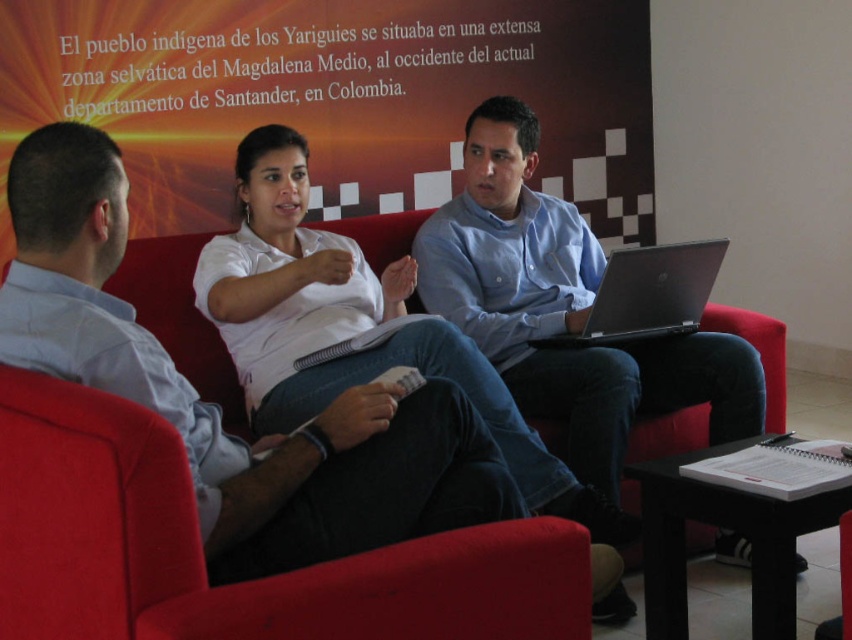
Is matte fabric armchair at lower left thinner than white cotton shirt at center?

Yes, matte fabric armchair at lower left is thinner than white cotton shirt at center.

Identify the location of matte fabric armchair at lower left. The width and height of the screenshot is (852, 640). (202, 556).

Which is in front, point (429, 568) or point (323, 381)?

Point (429, 568) is in front.

The height and width of the screenshot is (640, 852). Identify the location of matte fabric armchair at lower left. (202, 556).

Locate an element on the screen. red fabric couch at center is located at coordinates (200, 556).

Which is in front, point (85, 531) or point (625, 250)?

Point (85, 531) is in front.

You are a GUI agent. You are given a task and a screenshot of the screen. Output one action in this format:
    pyautogui.click(x=<x>, y=<y>)
    Task: Click on the red fabric couch at center
    
    Given the screenshot: What is the action you would take?
    pyautogui.click(x=200, y=556)

You are a GUI agent. You are given a task and a screenshot of the screen. Output one action in this format:
    pyautogui.click(x=<x>, y=<y>)
    Task: Click on the red fabric couch at center
    Image resolution: width=852 pixels, height=640 pixels.
    Given the screenshot: What is the action you would take?
    pyautogui.click(x=200, y=556)

Does blue denim jeans at center have a greater height compared to silver metallic laptop at center?

Yes, blue denim jeans at center is taller than silver metallic laptop at center.

Can you confirm if blue denim jeans at center is positioned below silver metallic laptop at center?

Indeed, blue denim jeans at center is positioned under silver metallic laptop at center.

Is point (435, 230) closer to camera compared to point (597, 298)?

No.

In order to click on blue denim jeans at center in this screenshot , I will do `click(563, 308)`.